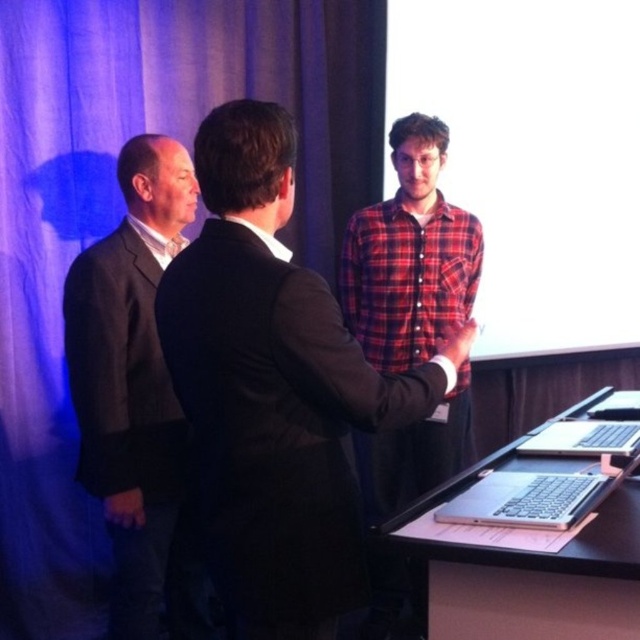
You are standing at the entrance of the room and want to approach the dark suit at center to greet them. Which direction should you move in to reach them?

To reach the dark suit at center, you should move towards the coordinates specified at point 0.611 on the x and 0.430 on the y axis.

Based on the photo, you are a photographer adjusting camera settings for a group photo. You need to ensure that both the dark gray suit at left and the red plaid shirt at center are in focus. Given that the camera can only focus on objects within a 1.2 meter height range, will both subjects be in focus if the focus is set on the taller subject?

The dark gray suit at left is shorter than the red plaid shirt at center. If the focus is set on the taller subject, the red plaid shirt at center, the height difference between them must be within 1.2 meters for both to be in focus. Since the exact height difference isn

You are organizing a photo shoot and need to arrange two people in the scene so that both can be clearly seen in the final image. Given the current positions of the dark suit at center and the red plaid shirt at center, is there a way to adjust their positions so that neither is blocking the other?

The dark suit at center might be wider than red plaid shirt at center, so if you move the red plaid shirt at center slightly to the side, it can avoid being blocked by the dark suit at center while still remaining in the frame.